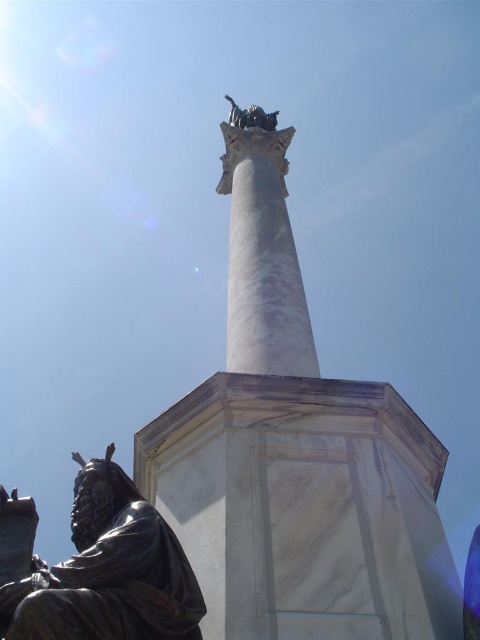
Does point (227, 308) come farther from viewer compared to point (237, 116)?

Yes, point (227, 308) is behind point (237, 116).

Who is taller, white marble column at center or bronze statue at top?

Standing taller between the two is white marble column at center.

Does point (241, 332) come in front of point (257, 122)?

Yes, it is in front of point (257, 122).

Locate an element on the screen. This screenshot has width=480, height=640. white marble column at center is located at coordinates (262, 252).

Does bronze statue at lower left have a smaller size compared to bronze statue at top?

Indeed, bronze statue at lower left has a smaller size compared to bronze statue at top.

Is bronze statue at lower left thinner than bronze statue at top?

Incorrect, bronze statue at lower left's width is not less than bronze statue at top's.

Image resolution: width=480 pixels, height=640 pixels. What do you see at coordinates (108, 570) in the screenshot? I see `bronze statue at lower left` at bounding box center [108, 570].

Locate an element on the screen. This screenshot has width=480, height=640. bronze statue at lower left is located at coordinates (108, 570).

Does point (152, 564) come in front of point (255, 150)?

Yes.

Does bronze statue at lower left have a greater height compared to white marble column at center?

No, bronze statue at lower left is not taller than white marble column at center.

At what (x,y) coordinates should I click in order to perform the action: click on bronze statue at lower left. Please return your answer as a coordinate pair (x, y). The height and width of the screenshot is (640, 480). Looking at the image, I should click on (108, 570).

Identify the location of bronze statue at lower left. (108, 570).